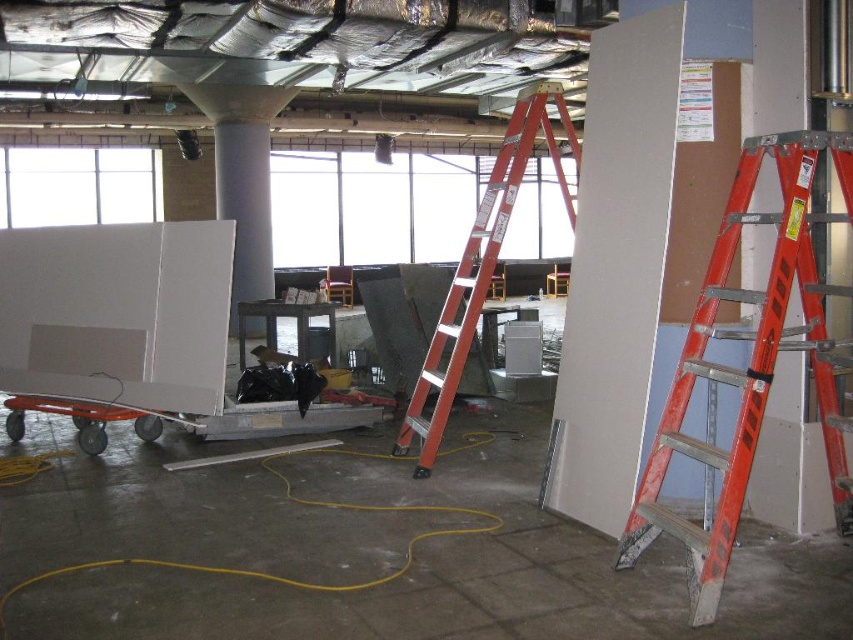
Is orange metallic ladder at right further to camera compared to white smooth column at center?

No, orange metallic ladder at right is closer to the viewer.

Does point (844, 340) lie behind point (254, 292)?

No, it is not.

Which is behind, point (718, 516) or point (244, 189)?

Positioned behind is point (244, 189).

This screenshot has height=640, width=853. I want to click on orange metallic ladder at right, so click(751, 362).

Which is below, smooth white pillar at right or white smooth column at center?

smooth white pillar at right

Is point (779, 460) farther from camera compared to point (252, 216)?

No.

You are a GUI agent. You are given a task and a screenshot of the screen. Output one action in this format:
    pyautogui.click(x=<x>, y=<y>)
    Task: Click on the smooth white pillar at right
    
    Given the screenshot: What is the action you would take?
    pyautogui.click(x=790, y=456)

How far apart are orange metallic ladder at center and white smooth column at center?

The distance of orange metallic ladder at center from white smooth column at center is 19.19 feet.

Can you confirm if orange metallic ladder at center is shorter than white smooth column at center?

Yes, orange metallic ladder at center is shorter than white smooth column at center.

Image resolution: width=853 pixels, height=640 pixels. What do you see at coordinates (482, 266) in the screenshot?
I see `orange metallic ladder at center` at bounding box center [482, 266].

I want to click on orange metallic ladder at center, so click(x=482, y=266).